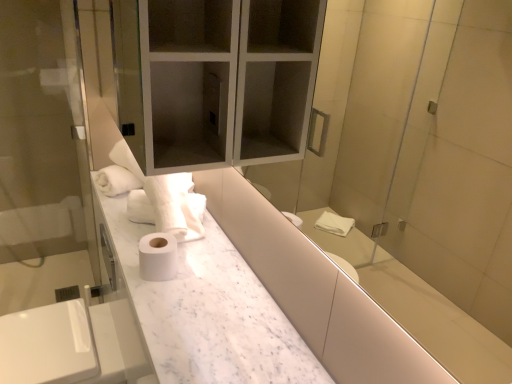
What are the coordinates of `white marble counter at center` in the screenshot? It's located at (210, 312).

Measure the distance between point (149, 40) and camera.

A distance of 36.22 inches exists between point (149, 40) and camera.

Describe the element at coordinates (158, 257) in the screenshot. I see `white matte toilet paper at center` at that location.

At what (x,y) coordinates should I click in order to perform the action: click on white marble counter at center. Please return your answer as a coordinate pair (x, y). The width and height of the screenshot is (512, 384). Looking at the image, I should click on (210, 312).

Is transparent glass screen door at left completely or partially outside of transparent glass medicine cabinet at upper center?

Yes.

Based on the photo, between transparent glass screen door at left and transparent glass medicine cabinet at upper center, which one has larger size?

transparent glass medicine cabinet at upper center.

Which of these two, transparent glass screen door at left or transparent glass medicine cabinet at upper center, is thinner?

With smaller width is transparent glass screen door at left.

From a real-world perspective, does transparent glass screen door at left stand above satin nickel faucet at lower left?

Indeed, from a real-world perspective, transparent glass screen door at left stands above satin nickel faucet at lower left.

Where is `faucet located on the right of transparent glass screen door at left`? faucet located on the right of transparent glass screen door at left is located at coordinates (108, 258).

Who is taller, transparent glass screen door at left or satin nickel faucet at lower left?

Standing taller between the two is transparent glass screen door at left.

Is transparent glass screen door at left positioned with its back to satin nickel faucet at lower left?

No, satin nickel faucet at lower left is not at the back of transparent glass screen door at left.

From the image's perspective, is satin nickel faucet at lower left on top of white matte toilet paper at center?

Incorrect, from the image's perspective, satin nickel faucet at lower left is lower than white matte toilet paper at center.

Is white matte toilet paper at center inside satin nickel faucet at lower left?

No, white matte toilet paper at center is not inside satin nickel faucet at lower left.

Based on the photo, in terms of height, does satin nickel faucet at lower left look taller or shorter compared to white matte toilet paper at center?

Considering their sizes, satin nickel faucet at lower left has more height than white matte toilet paper at center.

I want to click on medicine cabinet above the white matte toilet paper at center (from a real-world perspective), so click(x=216, y=80).

Does white matte toilet paper at center have a greater height compared to transparent glass medicine cabinet at upper center?

In fact, white matte toilet paper at center may be shorter than transparent glass medicine cabinet at upper center.

From the image's perspective, is white matte toilet paper at center located beneath transparent glass medicine cabinet at upper center?

Yes.

Does transparent glass screen door at left turn towards white matte toilet paper at center?

Yes, transparent glass screen door at left is aimed at white matte toilet paper at center.

In the image, is transparent glass screen door at left positioned in front of or behind white matte toilet paper at center?

Clearly, transparent glass screen door at left is behind white matte toilet paper at center.

Is transparent glass screen door at left not near white matte toilet paper at center?

Yes, transparent glass screen door at left is far from white matte toilet paper at center.

Based on the photo, from a real-world perspective, is transparent glass screen door at left physically located above or below white matte toilet paper at center?

From a real-world perspective, transparent glass screen door at left is physically below white matte toilet paper at center.

Considering their positions, is white marble counter at center located in front of or behind transparent glass screen door at left?

In the image, white marble counter at center appears in front of transparent glass screen door at left.

Measure the distance between white marble counter at center and transparent glass screen door at left.

The distance of white marble counter at center from transparent glass screen door at left is 4.30 feet.

Which object is wider, white marble counter at center or transparent glass screen door at left?

white marble counter at center is wider.

Is white matte toilet paper at center not inside satin nickel faucet at lower left?

Yes.

From the image's perspective, between white matte toilet paper at center and satin nickel faucet at lower left, which one is located above?

white matte toilet paper at center is shown above in the image.

Which of these two, white matte toilet paper at center or satin nickel faucet at lower left, is thinner?

Thinner between the two is satin nickel faucet at lower left.

Is white matte toilet paper at center further to the viewer compared to satin nickel faucet at lower left?

No, it is not.

At what (x,y) coordinates should I click in order to perform the action: click on screen door below the transparent glass medicine cabinet at upper center (from a real-world perspective). Please return your answer as a coordinate pair (x, y). Looking at the image, I should click on (42, 157).

Locate an element on the screen. The height and width of the screenshot is (384, 512). screen door above the satin nickel faucet at lower left (from the image's perspective) is located at coordinates (42, 157).

From the image, which object appears to be farther from white marble counter at center, transparent glass medicine cabinet at upper center or satin nickel faucet at lower left?

satin nickel faucet at lower left lies further to white marble counter at center than the other object.

Considering their positions, is satin nickel faucet at lower left positioned closer to white matte toilet paper at center than white marble counter at center?

white marble counter at center is positioned closer to the anchor white matte toilet paper at center.

From the image, which object appears to be farther from transparent glass screen door at left, white matte toilet paper at center or white marble counter at center?

white matte toilet paper at center lies further to transparent glass screen door at left than the other object.

Looking at the image, which one is located closer to white matte toilet paper at center, white marble counter at center or transparent glass medicine cabinet at upper center?

white marble counter at center lies closer to white matte toilet paper at center than the other object.

Based on their spatial positions, is transparent glass medicine cabinet at upper center or white marble counter at center closer to transparent glass screen door at left?

white marble counter at center is closer to transparent glass screen door at left.

When comparing their distances from transparent glass medicine cabinet at upper center, does white matte toilet paper at center or transparent glass screen door at left seem closer?

white matte toilet paper at center is positioned closer to the anchor transparent glass medicine cabinet at upper center.

From the image, which object appears to be farther from white marble counter at center, white matte toilet paper at center or transparent glass medicine cabinet at upper center?

transparent glass medicine cabinet at upper center is further to white marble counter at center.

Estimate the real-world distances between objects in this image. Which object is further from transparent glass medicine cabinet at upper center, transparent glass screen door at left or satin nickel faucet at lower left?

transparent glass screen door at left is further to transparent glass medicine cabinet at upper center.

This screenshot has height=384, width=512. I want to click on screen door between white marble counter at center and satin nickel faucet at lower left from front to back, so click(42, 157).

Locate an element on the screen. The width and height of the screenshot is (512, 384). toilet paper between transparent glass medicine cabinet at upper center and satin nickel faucet at lower left vertically is located at coordinates (158, 257).

I want to click on faucet located between transparent glass screen door at left and white matte toilet paper at center in the left-right direction, so click(x=108, y=258).

Where is `counter between transparent glass medicine cabinet at upper center and white matte toilet paper at center from top to bottom`? The width and height of the screenshot is (512, 384). counter between transparent glass medicine cabinet at upper center and white matte toilet paper at center from top to bottom is located at coordinates (210, 312).